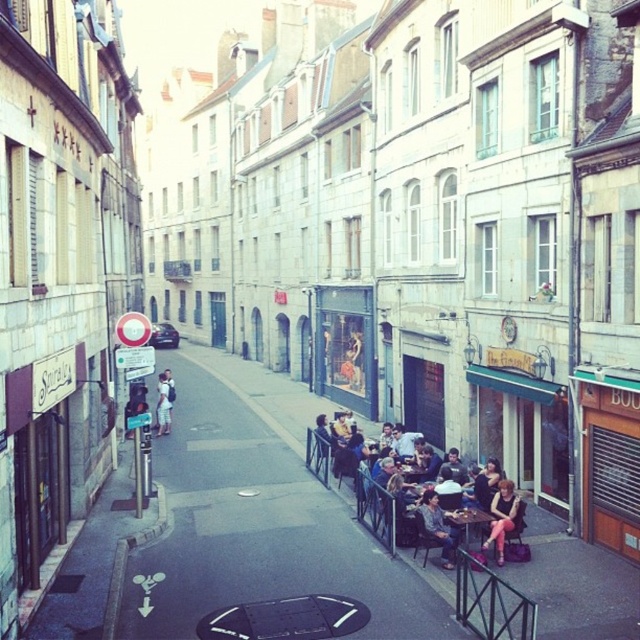
Question: Does matte black table at center have a larger size compared to wooden table at lower right?

Choices:
 (A) no
 (B) yes

Answer: (B)

Question: Is matte black table at center to the left of wooden table at lower right from the viewer's perspective?

Choices:
 (A) no
 (B) yes

Answer: (B)

Question: Which is nearer to the denim shorts at lower right?

Choices:
 (A) matte black table at center
 (B) wooden table at lower right

Answer: (B)

Question: Does matte black table at center appear over denim jacket at lower right?

Choices:
 (A) no
 (B) yes

Answer: (B)

Question: Which point is closer to the camera taking this photo?

Choices:
 (A) (444, 566)
 (B) (499, 509)
 (C) (461, 522)
 (D) (515, 502)

Answer: (A)

Question: Which point is closer to the camera?

Choices:
 (A) matte black table at center
 (B) light brown leather jacket at center

Answer: (A)